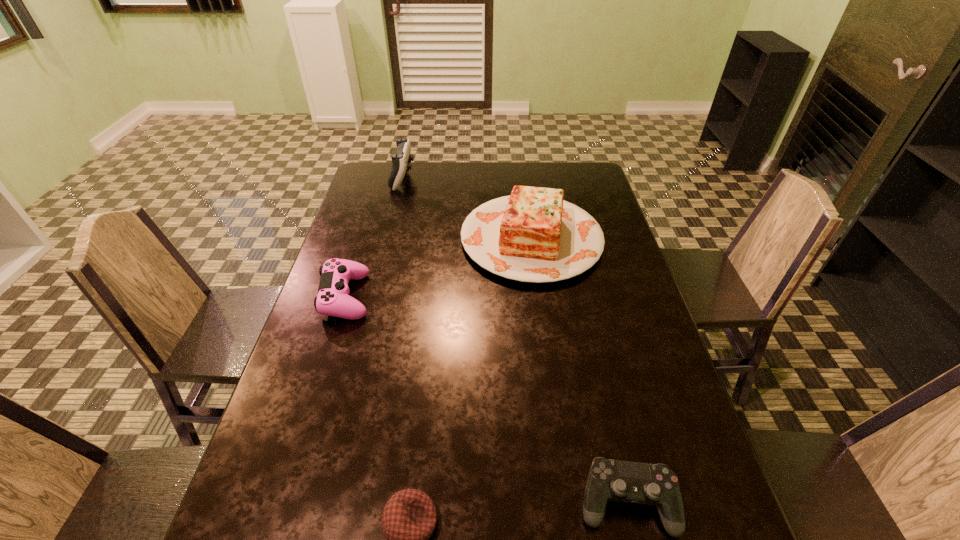
What are the coordinates of `vacant area between the lasagna and the farthest object` in the screenshot? It's located at (468, 208).

Point out which object is positioned as the nearest to the second farthest control. Please provide its 2D coordinates. Your answer should be formatted as a tuple, i.e. [(x, y)], where the tuple contains the x and y coordinates of a point satisfying the conditions above.

[(533, 235)]

Image resolution: width=960 pixels, height=540 pixels. What are the coordinates of `object that ranks as the fourth closest to the lasagna` in the screenshot? It's located at (409, 518).

At what (x,y) coordinates should I click in order to perform the action: click on the second closest control to the shortest object. Please return your answer as a coordinate pair (x, y). Looking at the image, I should click on (332, 300).

You are a GUI agent. You are given a task and a screenshot of the screen. Output one action in this format:
    pyautogui.click(x=<x>, y=<y>)
    Task: Click on the control identified as the second closest to the nearest control
    The width and height of the screenshot is (960, 540).
    Given the screenshot: What is the action you would take?
    pyautogui.click(x=400, y=161)